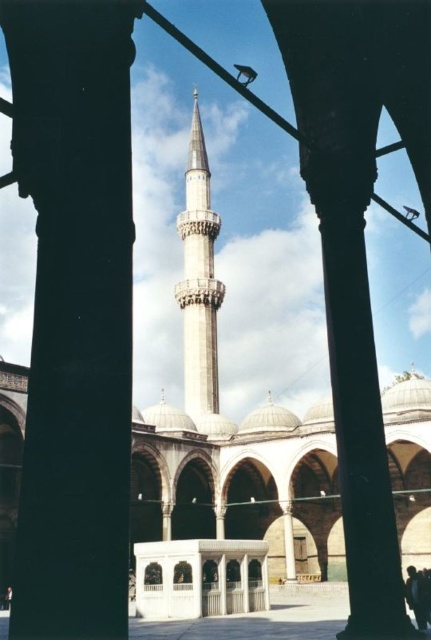
You are standing in the courtyard of the mosque and want to walk directly towards the white marble minaret at center. Which direction should you move relative to the smooth stone pillar at center?

You should move to the left relative to the smooth stone pillar at center because the smooth stone pillar at center is to the right of the white marble minaret at center, so moving left will bring you closer to the minaret.